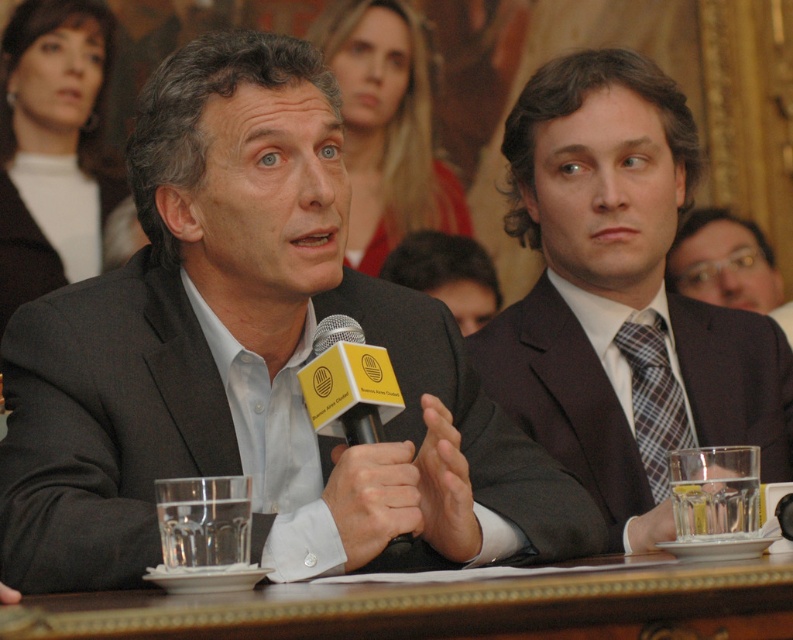
Question: Can you confirm if dark brown suit at center is bigger than plaid fabric tie at right?

Choices:
 (A) yes
 (B) no

Answer: (A)

Question: Which point is closer to the camera?

Choices:
 (A) (274, 204)
 (B) (366, 426)

Answer: (B)

Question: Observing the image, what is the correct spatial positioning of matte black suit at center in reference to yellow plastic microphone at center?

Choices:
 (A) below
 (B) above

Answer: (B)

Question: Among these points, which one is nearest to the camera?

Choices:
 (A) (684, 362)
 (B) (726, 266)
 (C) (458, 243)

Answer: (A)

Question: Is plaid fabric tie at right to the left of matte black suit at center from the viewer's perspective?

Choices:
 (A) yes
 (B) no

Answer: (B)

Question: Which of the following is the closest to the observer?

Choices:
 (A) (451, 298)
 (B) (726, 291)

Answer: (B)